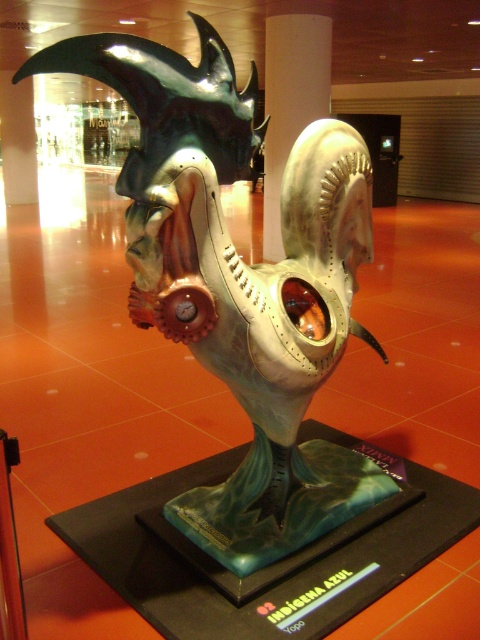
Question: Is metallic/textured mask at center bigger than metallic gold at center?

Choices:
 (A) no
 (B) yes

Answer: (B)

Question: Where is metallic/textured mask at center located in relation to metallic gold at center in the image?

Choices:
 (A) above
 (B) below

Answer: (B)

Question: Which point is farther to the camera?

Choices:
 (A) (265, 195)
 (B) (238, 333)

Answer: (A)

Question: Among these points, which one is farthest from the camera?

Choices:
 (A) (264, 234)
 (B) (166, 136)

Answer: (A)

Question: Among these objects, which one is farthest from the camera?

Choices:
 (A) metallic/textured mask at center
 (B) metallic gold at center

Answer: (B)

Question: Does metallic/textured mask at center have a greater width compared to metallic gold at center?

Choices:
 (A) no
 (B) yes

Answer: (B)